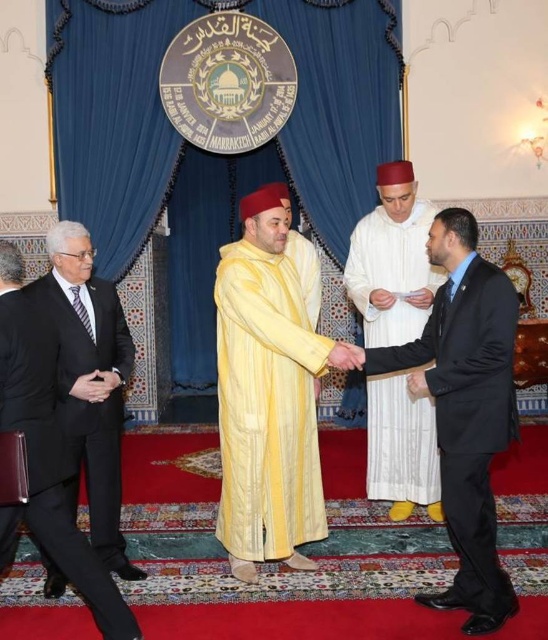
You are an event organizer who needs to arrange seating for two guests wearing the white textured robe at center and the black suit at left. Given their clothing widths, which guest should be seated in a wider chair to accommodate their robe?

The white textured robe at center is wider than the black suit at left, so the guest wearing the white textured robe at center should be seated in a wider chair to accommodate their robe.